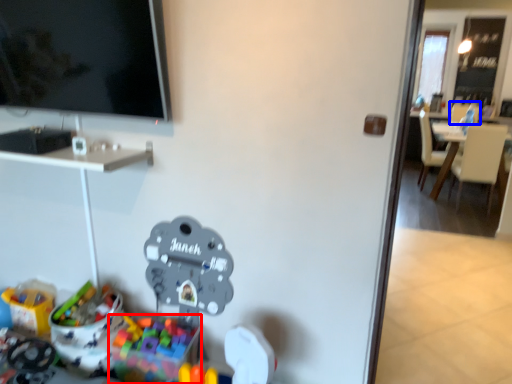
Question: Which object appears farthest to the camera in this image, toy (highlighted by a red box) or armchair (highlighted by a blue box)?

Choices:
 (A) toy
 (B) armchair

Answer: (B)